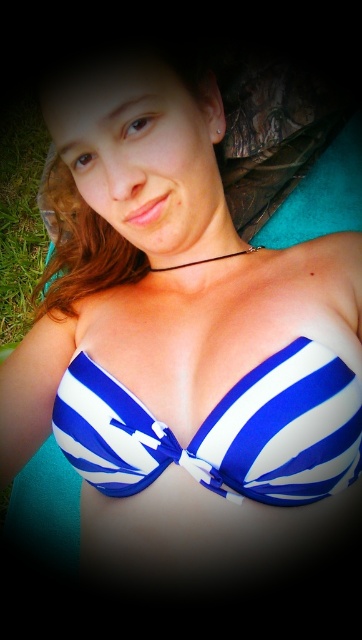
Question: Is blue striped bikini top at center below green grass at lower left?

Choices:
 (A) no
 (B) yes

Answer: (B)

Question: Among these objects, which one is farthest from the camera?

Choices:
 (A) blue striped bikini top at center
 (B) green grass at lower left

Answer: (B)

Question: Does blue striped bikini top at center appear under green grass at lower left?

Choices:
 (A) yes
 (B) no

Answer: (A)

Question: Can you confirm if blue striped bikini top at center is wider than green grass at lower left?

Choices:
 (A) yes
 (B) no

Answer: (A)

Question: Which of the following is the closest to the observer?

Choices:
 (A) (26, 308)
 (B) (246, 426)

Answer: (B)